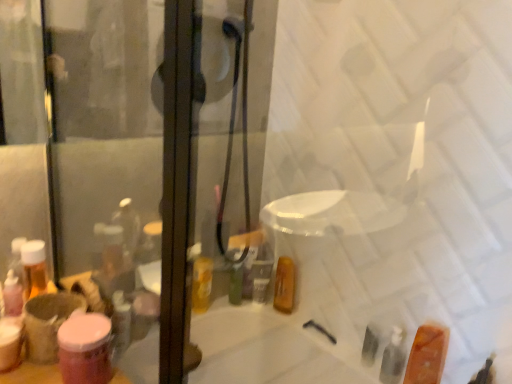
Question: Considering the relative positions of translucent orange soap at lower right, the 2th toiletry viewed from the front, and pink matte jar at lower left, the first toiletry when ordered from front to back, in the image provided, is translucent orange soap at lower right, the 2th toiletry viewed from the front, to the left or to the right of pink matte jar at lower left, the first toiletry when ordered from front to back,?

Choices:
 (A) right
 (B) left

Answer: (A)

Question: From the image's perspective, relative to pink matte jar at lower left, which appears as the second toiletry when viewed from the right, is translucent orange soap at lower right, arranged as the first toiletry when ordered from the bottom, above or below?

Choices:
 (A) above
 (B) below

Answer: (B)

Question: From a real-world perspective, is translucent orange soap at lower right, placed as the 2th toiletry when sorted from top to bottom, physically located above or below pink matte jar at lower left, the 2th toiletry from the back?

Choices:
 (A) below
 (B) above

Answer: (A)

Question: In terms of width, does pink matte jar at lower left, marked as the 2th toiletry in a bottom-to-top arrangement, look wider or thinner when compared to translucent orange soap at lower right, marked as the second toiletry in a left-to-right arrangement?

Choices:
 (A) thin
 (B) wide

Answer: (A)

Question: Which is correct: pink matte jar at lower left, the first toiletry when ordered from front to back, is inside translucent orange soap at lower right, arranged as the first toiletry when ordered from the bottom, or outside of it?

Choices:
 (A) inside
 (B) outside

Answer: (B)

Question: Considering their positions, is pink matte jar at lower left, the first toiletry when ordered from front to back, located in front of or behind translucent orange soap at lower right, marked as the second toiletry in a left-to-right arrangement?

Choices:
 (A) front
 (B) behind

Answer: (A)

Question: Does point (96, 355) appear closer or farther from the camera than point (411, 367)?

Choices:
 (A) closer
 (B) farther

Answer: (A)